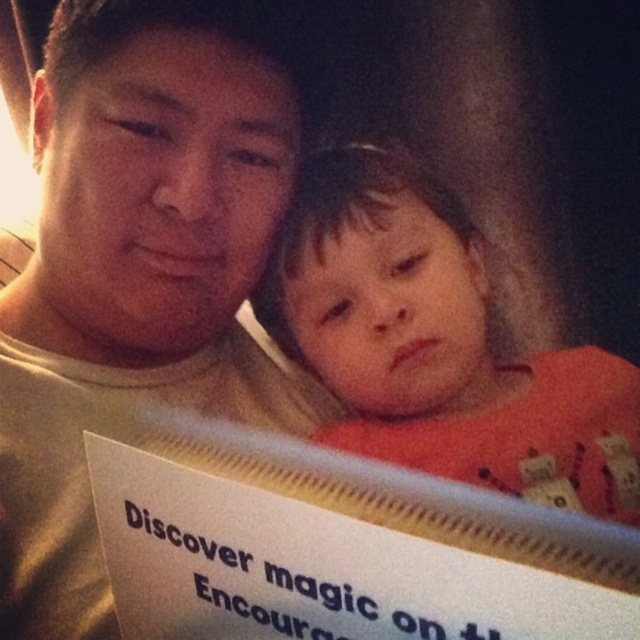
Question: Does matte beige shirt at center have a smaller size compared to orange cotton shirt at center?

Choices:
 (A) yes
 (B) no

Answer: (B)

Question: From the image, what is the correct spatial relationship of matte beige shirt at center in relation to orange cotton shirt at center?

Choices:
 (A) above
 (B) below

Answer: (A)

Question: Which point is closer to the camera taking this photo?

Choices:
 (A) (38, 500)
 (B) (356, 189)

Answer: (A)

Question: Can you confirm if matte beige shirt at center is wider than orange cotton shirt at center?

Choices:
 (A) no
 (B) yes

Answer: (A)

Question: Which point is farther to the camera?

Choices:
 (A) (355, 403)
 (B) (284, 426)

Answer: (B)